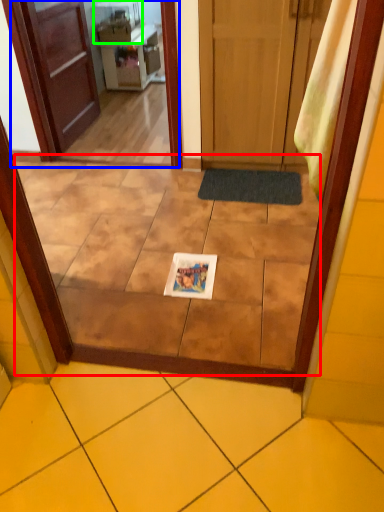
Question: Which is farther away from ceramic tile (highlighted by a red box)? screen door (highlighted by a blue box) or appliance (highlighted by a green box)?

Choices:
 (A) screen door
 (B) appliance

Answer: (B)